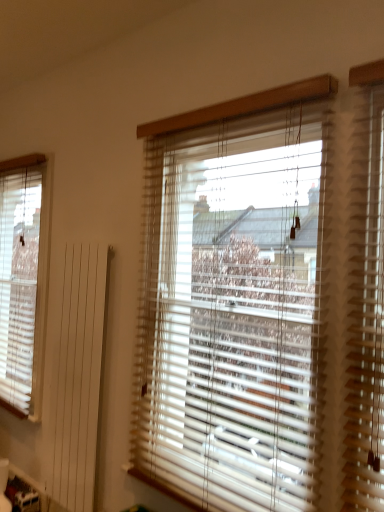
What do you see at coordinates (24, 280) in the screenshot? Image resolution: width=384 pixels, height=512 pixels. I see `white wood blinds at left, which is counted as the 1th window blind, starting from the left` at bounding box center [24, 280].

Looking at this image, measure the distance between point (3, 206) and camera.

A distance of 11.85 feet exists between point (3, 206) and camera.

This screenshot has height=512, width=384. Find the location of `white wood blinds at left, the second window blind viewed from the right`. white wood blinds at left, the second window blind viewed from the right is located at coordinates (24, 280).

Find the location of `wooden blinds at center, which ranks as the second window blind in left-to-right order`. wooden blinds at center, which ranks as the second window blind in left-to-right order is located at coordinates (231, 309).

The width and height of the screenshot is (384, 512). Describe the element at coordinates (231, 309) in the screenshot. I see `wooden blinds at center, positioned as the 1th window blind in right-to-left order` at that location.

At what (x,y) coordinates should I click in order to perform the action: click on white wood blinds at left, the second window blind viewed from the right. Please return your answer as a coordinate pair (x, y). Looking at the image, I should click on (24, 280).

Is wooden blinds at center, which ranks as the second window blind in left-to-right order, to the left of white wood blinds at left, which is counted as the 1th window blind, starting from the left, from the viewer's perspective?

In fact, wooden blinds at center, which ranks as the second window blind in left-to-right order, is to the right of white wood blinds at left, which is counted as the 1th window blind, starting from the left.

Considering the positions of objects wooden blinds at center, which is the second window blind from back to front, and white wood blinds at left, which is counted as the 1th window blind, starting from the left, in the image provided, who is in front, wooden blinds at center, which is the second window blind from back to front, or white wood blinds at left, which is counted as the 1th window blind, starting from the left,?

wooden blinds at center, which is the second window blind from back to front, is closer to the camera.

Which point is more distant from viewer, (210, 227) or (6, 303)?

The point (6, 303) is farther.

From the image's perspective, which is below, wooden blinds at center, which is the second window blind from back to front, or white wood blinds at left, the second window blind viewed from the right?

wooden blinds at center, which is the second window blind from back to front, is shown below in the image.

From a real-world perspective, is wooden blinds at center, positioned as the 1th window blind in right-to-left order, positioned over white wood blinds at left, the second window blind viewed from the right, based on gravity?

Yes, from a real-world perspective, wooden blinds at center, positioned as the 1th window blind in right-to-left order, is on top of white wood blinds at left, the second window blind viewed from the right.

Which of these two, wooden blinds at center, which ranks as the 1th window blind in front-to-back order, or white wood blinds at left, which is counted as the 1th window blind, starting from the left, is thinner?

With smaller width is white wood blinds at left, which is counted as the 1th window blind, starting from the left.

Is wooden blinds at center, which ranks as the 1th window blind in front-to-back order, taller than white wood blinds at left, which is counted as the 1th window blind, starting from the left?

In fact, wooden blinds at center, which ranks as the 1th window blind in front-to-back order, may be shorter than white wood blinds at left, which is counted as the 1th window blind, starting from the left.

Considering the sizes of objects wooden blinds at center, which is the second window blind from back to front, and white wood blinds at left, which is counted as the 1th window blind, starting from the left, in the image provided, who is smaller, wooden blinds at center, which is the second window blind from back to front, or white wood blinds at left, which is counted as the 1th window blind, starting from the left,?

white wood blinds at left, which is counted as the 1th window blind, starting from the left.

Can we say wooden blinds at center, which ranks as the 1th window blind in front-to-back order, lies outside white wood blinds at left, the second window blind viewed from the right?

wooden blinds at center, which ranks as the 1th window blind in front-to-back order, lies outside white wood blinds at left, the second window blind viewed from the right,'s area.

Is wooden blinds at center, which is the second window blind from back to front, placed right next to white wood blinds at left, the 2th window blind when ordered from front to back?

There is a gap between wooden blinds at center, which is the second window blind from back to front, and white wood blinds at left, the 2th window blind when ordered from front to back.

Could you tell me if wooden blinds at center, which ranks as the second window blind in left-to-right order, is facing white wood blinds at left, the second window blind viewed from the right?

No, wooden blinds at center, which ranks as the second window blind in left-to-right order, is not oriented towards white wood blinds at left, the second window blind viewed from the right.

Find the location of a particular element. This screenshot has width=384, height=512. window blind that appears above the white wood blinds at left, which is counted as the 1th window blind, starting from the left (from a real-world perspective) is located at coordinates pyautogui.click(x=231, y=309).

Considering the positions of objects white wood blinds at left, the first window blind viewed from the back, and wooden blinds at center, which ranks as the second window blind in left-to-right order, in the image provided, who is more to the right, white wood blinds at left, the first window blind viewed from the back, or wooden blinds at center, which ranks as the second window blind in left-to-right order,?

From the viewer's perspective, wooden blinds at center, which ranks as the second window blind in left-to-right order, appears more on the right side.

Which object is closer to the camera, white wood blinds at left, the 2th window blind when ordered from front to back, or wooden blinds at center, positioned as the 1th window blind in right-to-left order?

wooden blinds at center, positioned as the 1th window blind in right-to-left order, is more forward.

Which is closer to the camera, (18, 320) or (283, 236)?

Positioned in front is point (283, 236).

From the image's perspective, between white wood blinds at left, the 2th window blind when ordered from front to back, and wooden blinds at center, positioned as the 1th window blind in right-to-left order, which one is located above?

white wood blinds at left, the 2th window blind when ordered from front to back, appears higher in the image.

From a real-world perspective, is white wood blinds at left, which is counted as the 1th window blind, starting from the left, physically located above or below wooden blinds at center, which ranks as the second window blind in left-to-right order?

→ From a real-world perspective, white wood blinds at left, which is counted as the 1th window blind, starting from the left, is physically below wooden blinds at center, which ranks as the second window blind in left-to-right order.

Between white wood blinds at left, the 2th window blind when ordered from front to back, and wooden blinds at center, positioned as the 1th window blind in right-to-left order, which one has smaller width?

white wood blinds at left, the 2th window blind when ordered from front to back.

Considering the relative sizes of white wood blinds at left, the first window blind viewed from the back, and wooden blinds at center, positioned as the 1th window blind in right-to-left order, in the image provided, is white wood blinds at left, the first window blind viewed from the back, taller than wooden blinds at center, positioned as the 1th window blind in right-to-left order,?

Yes.

Between white wood blinds at left, the 2th window blind when ordered from front to back, and wooden blinds at center, which is the second window blind from back to front, which one has larger size?

Bigger between the two is wooden blinds at center, which is the second window blind from back to front.

Is white wood blinds at left, which is counted as the 1th window blind, starting from the left, not within wooden blinds at center, which ranks as the 1th window blind in front-to-back order?

Absolutely, white wood blinds at left, which is counted as the 1th window blind, starting from the left, is external to wooden blinds at center, which ranks as the 1th window blind in front-to-back order.

Is white wood blinds at left, the first window blind viewed from the back, next to wooden blinds at center, positioned as the 1th window blind in right-to-left order?

white wood blinds at left, the first window blind viewed from the back, is not next to wooden blinds at center, positioned as the 1th window blind in right-to-left order, and they're not touching.

Does white wood blinds at left, the second window blind viewed from the right, turn towards wooden blinds at center, which ranks as the second window blind in left-to-right order?

No, white wood blinds at left, the second window blind viewed from the right, is not turned towards wooden blinds at center, which ranks as the second window blind in left-to-right order.

How many degrees apart are the facing directions of white wood blinds at left, the 2th window blind when ordered from front to back, and wooden blinds at center, which ranks as the second window blind in left-to-right order?

The angular difference between white wood blinds at left, the 2th window blind when ordered from front to back, and wooden blinds at center, which ranks as the second window blind in left-to-right order, is 0.00665 degrees.

The width and height of the screenshot is (384, 512). I want to click on window blind below the white wood blinds at left, the first window blind viewed from the back (from the image's perspective), so click(231, 309).

Identify the location of window blind that is on the right side of white wood blinds at left, the first window blind viewed from the back. This screenshot has width=384, height=512. (231, 309).

The width and height of the screenshot is (384, 512). I want to click on window blind below the wooden blinds at center, positioned as the 1th window blind in right-to-left order (from a real-world perspective), so click(24, 280).